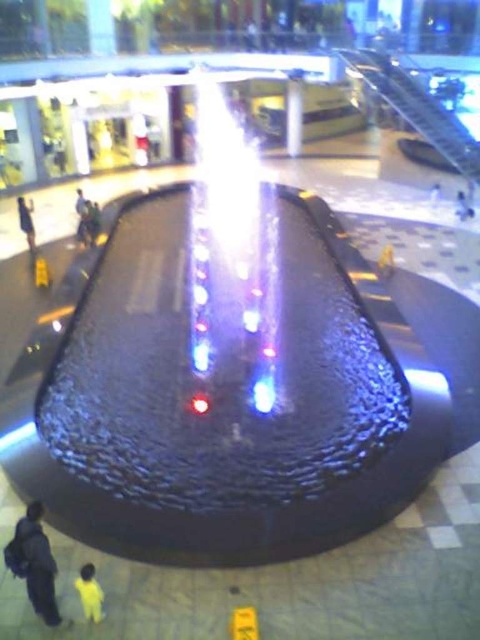
Is white glossy pillar at center thinner than yellow fabric person at lower left?

Incorrect, white glossy pillar at center's width is not less than yellow fabric person at lower left's.

Is white glossy pillar at center wider than yellow fabric person at lower left?

Indeed, white glossy pillar at center has a greater width compared to yellow fabric person at lower left.

Is point (295, 120) positioned behind point (83, 609)?

Yes, point (295, 120) is behind point (83, 609).

Where is `white glossy pillar at center`? The width and height of the screenshot is (480, 640). white glossy pillar at center is located at coordinates (294, 115).

Does metallic silver escalator at upper right have a lesser height compared to dark blue jacket at lower left?

Incorrect, metallic silver escalator at upper right's height does not fall short of dark blue jacket at lower left's.

Is metallic silver escalator at upper right to the left of dark blue jacket at lower left from the viewer's perspective?

In fact, metallic silver escalator at upper right is to the right of dark blue jacket at lower left.

Which is in front, point (347, 52) or point (39, 600)?

Positioned in front is point (39, 600).

Locate an element on the screen. Image resolution: width=480 pixels, height=640 pixels. metallic silver escalator at upper right is located at coordinates (416, 108).

Based on the photo, between translucent glass water at center and yellow fabric person at lower left, which one is positioned higher?

translucent glass water at center is higher up.

Is translucent glass water at center bigger than yellow fabric person at lower left?

Indeed, translucent glass water at center has a larger size compared to yellow fabric person at lower left.

What do you see at coordinates (230, 256) in the screenshot? I see `translucent glass water at center` at bounding box center [230, 256].

Where is `translucent glass water at center`? Image resolution: width=480 pixels, height=640 pixels. translucent glass water at center is located at coordinates (230, 256).